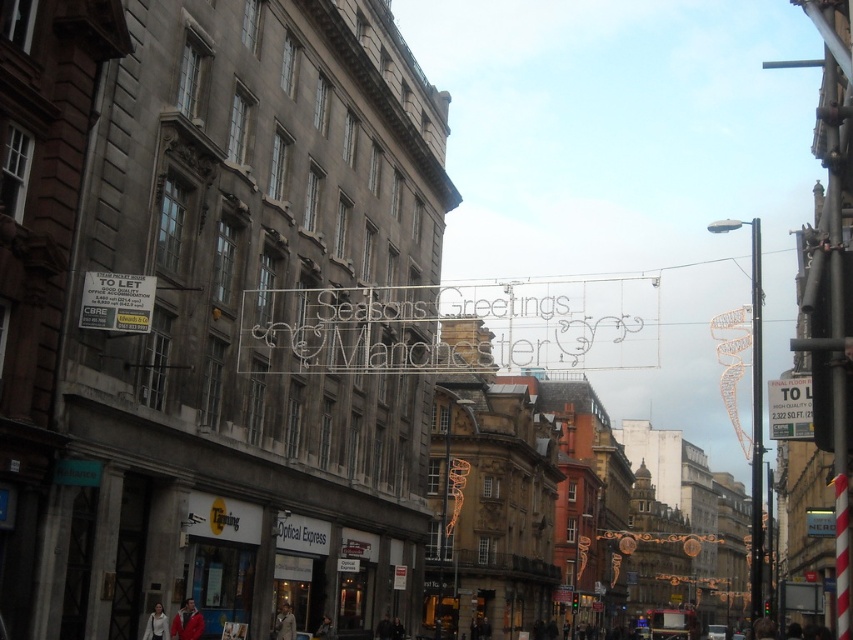
You are a delivery person trying to find the address of the light beige coat at center. You see a white paper sign at left. Is the sign above or below the coat?

The white paper sign at left is positioned over the light beige coat at center, meaning it is above the coat.